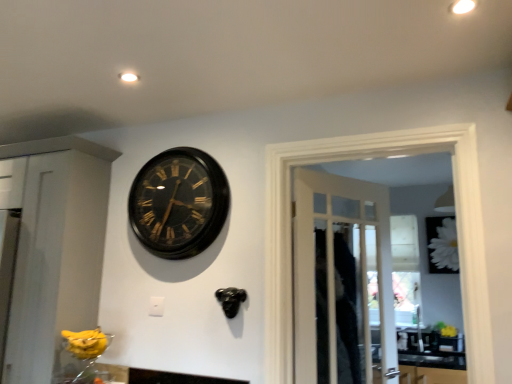
Question: Can you confirm if black polished wood clock at upper center is positioned to the right of white matte flower at upper right?

Choices:
 (A) yes
 (B) no

Answer: (B)

Question: From the image's perspective, is black polished wood clock at upper center above white matte flower at upper right?

Choices:
 (A) no
 (B) yes

Answer: (B)

Question: Is black polished wood clock at upper center at the left side of white matte flower at upper right?

Choices:
 (A) yes
 (B) no

Answer: (A)

Question: Can you confirm if black polished wood clock at upper center is wider than white matte flower at upper right?

Choices:
 (A) yes
 (B) no

Answer: (A)

Question: From a real-world perspective, is black polished wood clock at upper center positioned under white matte flower at upper right based on gravity?

Choices:
 (A) yes
 (B) no

Answer: (B)

Question: Are black polished wood clock at upper center and white matte flower at upper right located far from each other?

Choices:
 (A) yes
 (B) no

Answer: (A)

Question: Considering the relative positions of wooden door at center and white matte flower at upper right in the image provided, is wooden door at center to the right of white matte flower at upper right from the viewer's perspective?

Choices:
 (A) yes
 (B) no

Answer: (B)

Question: From a real-world perspective, does wooden door at center sit lower than white matte flower at upper right?

Choices:
 (A) no
 (B) yes

Answer: (B)

Question: Considering the relative positions of wooden door at center and white matte flower at upper right in the image provided, is wooden door at center behind white matte flower at upper right?

Choices:
 (A) yes
 (B) no

Answer: (B)

Question: Is wooden door at center surrounding white matte flower at upper right?

Choices:
 (A) no
 (B) yes

Answer: (A)

Question: Can you confirm if wooden door at center is shorter than white matte flower at upper right?

Choices:
 (A) yes
 (B) no

Answer: (B)

Question: From the image's perspective, is wooden door at center beneath white matte flower at upper right?

Choices:
 (A) yes
 (B) no

Answer: (B)

Question: Would you say wooden door at center is a long distance from white glossy sink at lower right?

Choices:
 (A) no
 (B) yes

Answer: (B)